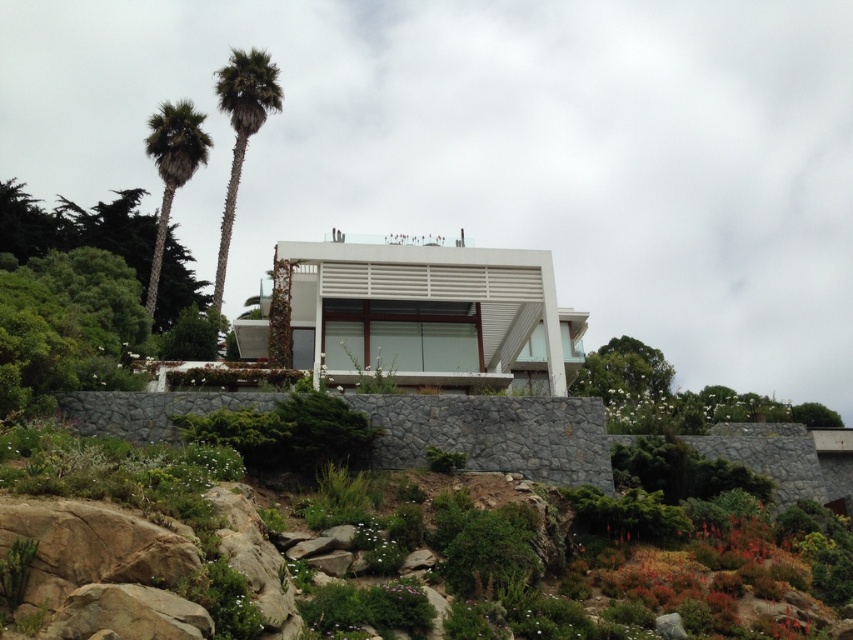
Between green leafy palm tree at upper left and green leafy palm tree at left, which one appears on the left side from the viewer's perspective?

From the viewer's perspective, green leafy palm tree at upper left appears more on the left side.

Can you confirm if green leafy palm tree at upper left is smaller than green leafy palm tree at left?

Incorrect, green leafy palm tree at upper left is not smaller in size than green leafy palm tree at left.

Does point (267, 108) lie behind point (148, 308)?

Yes.

The image size is (853, 640). Identify the location of green leafy palm tree at upper left. click(241, 134).